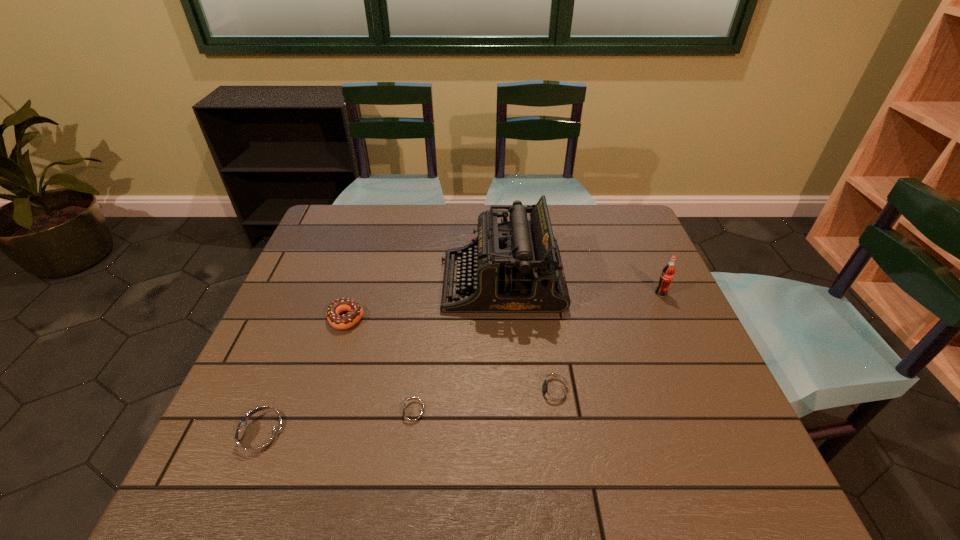
You are a GUI agent. You are given a task and a screenshot of the screen. Output one action in this format:
    pyautogui.click(x=<x>, y=<y>)
    Task: Click on the tallest watch
    Image resolution: width=960 pixels, height=540 pixels.
    Given the screenshot: What is the action you would take?
    pyautogui.click(x=260, y=437)

At what (x,y) coordinates should I click in order to perform the action: click on the shortest watch. Please return your answer as a coordinate pair (x, y). Looking at the image, I should click on (412, 414).

Image resolution: width=960 pixels, height=540 pixels. I want to click on the second watch from left to right, so pos(412,414).

Identify the location of the second shortest object. (553, 393).

This screenshot has width=960, height=540. Identify the location of the rightmost watch. (553, 393).

Find the location of a particular element. The image size is (960, 540). typewriter is located at coordinates (515, 266).

The image size is (960, 540). I want to click on doughnut, so click(355, 313).

The width and height of the screenshot is (960, 540). What are the coordinates of `the fifth shortest object` in the screenshot? It's located at (668, 272).

Where is `soda bottle`? The image size is (960, 540). soda bottle is located at coordinates (668, 272).

The image size is (960, 540). I want to click on vacant position located 0.340m on the face of the shortest object, so click(x=228, y=414).